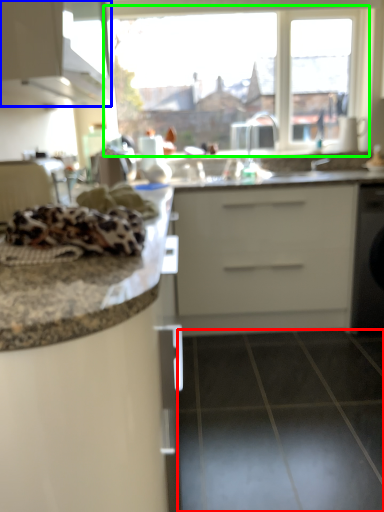
Question: Which object is positioned closest to tile (highlighted by a red box)? Select from cabinetry (highlighted by a blue box) and window (highlighted by a green box).

Choices:
 (A) cabinetry
 (B) window

Answer: (A)